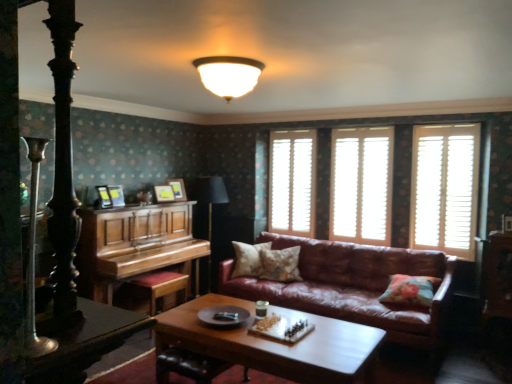
Question: From a real-world perspective, is wooden picture frame at upper center, which is the second picture frame in front-to-back order, physically located above or below shiny black table at lower left?

Choices:
 (A) above
 (B) below

Answer: (A)

Question: Is wooden picture frame at upper center, arranged as the second picture frame when viewed from the left, taller or shorter than shiny black table at lower left?

Choices:
 (A) short
 (B) tall

Answer: (A)

Question: Which object is positioned farthest from the polished wood piano at left?

Choices:
 (A) fluffy beige pillow at center, which ranks as the 2th pillow in right-to-left order
 (B) shiny black table at lower left
 (C) floral fabric cushion at right, the 1th pillow when ordered from right to left
 (D) black fabric lamp at center
 (E) leather couch at center

Answer: (B)

Question: Which of these objects is positioned closest to the white wooden shutters at center, the 3th window positioned from the right?

Choices:
 (A) floral fabric pillow at center, which appears as the first pillow when viewed from the back
 (B) wooden picture frame at upper center, the first picture frame when ordered from right to left
 (C) white wooden shutters at right, the first window when ordered from right to left
 (D) white wooden shutters at center, which ranks as the 2th window in back-to-front order
 (E) polished wood piano at left

Answer: (D)